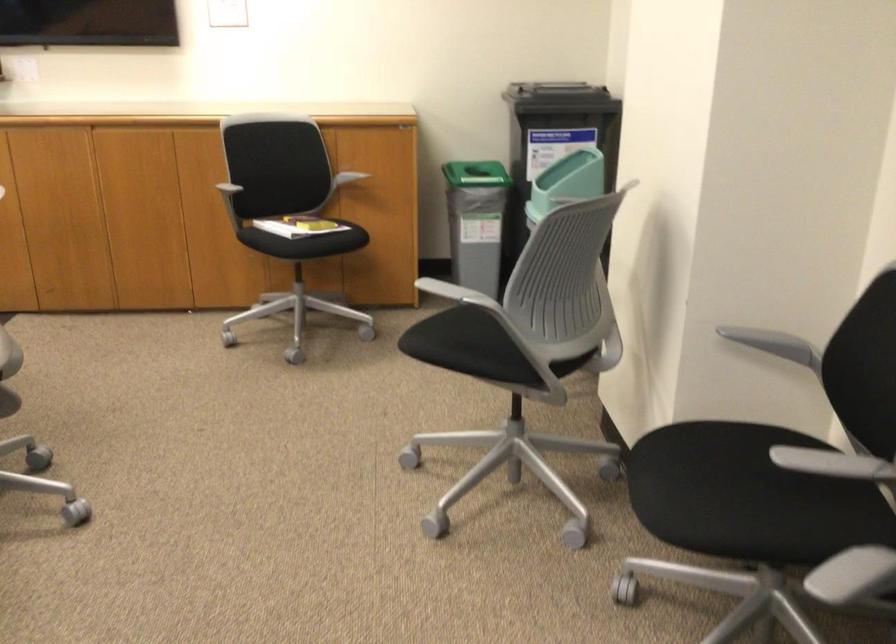
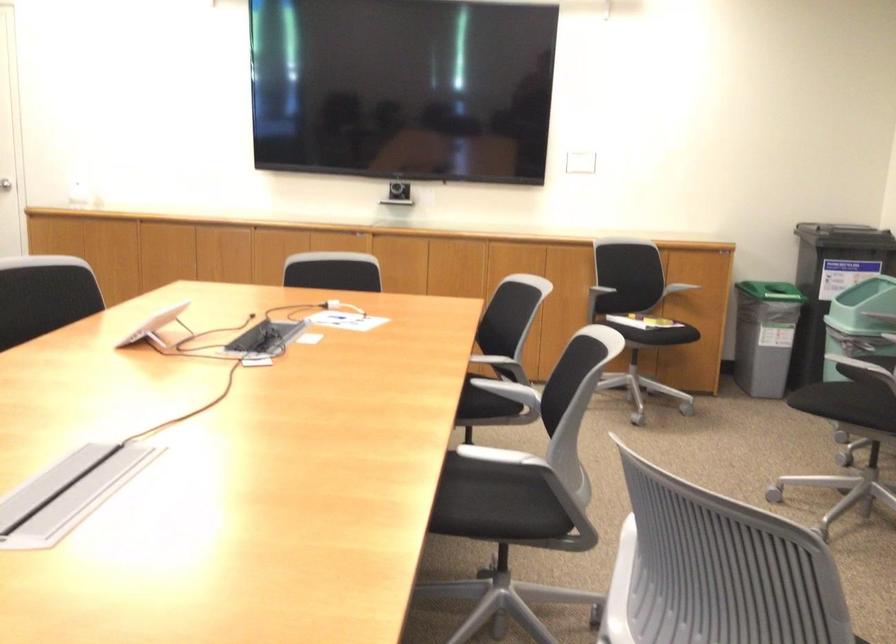
In the second image, find the point that corresponds to (x=290, y=238) in the first image.

(636, 313)